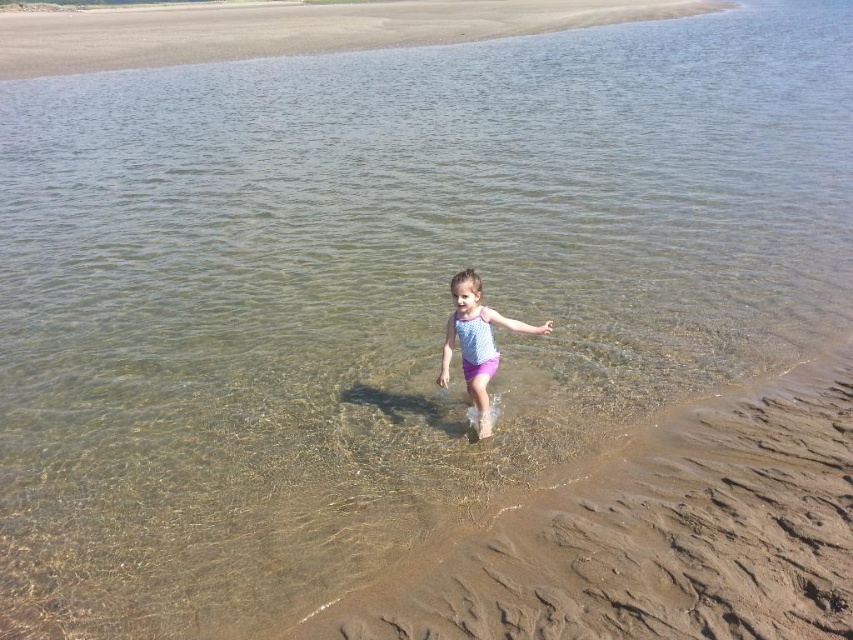
Question: Estimate the real-world distances between objects in this image. Which object is closer to the smooth brown sand at center?

Choices:
 (A) smooth sand at upper center
 (B) patterned fabric child at center

Answer: (B)

Question: Which object appears closest to the camera in this image?

Choices:
 (A) patterned fabric child at center
 (B) smooth brown sand at center

Answer: (B)

Question: Does smooth sand at upper center appear over patterned fabric child at center?

Choices:
 (A) no
 (B) yes

Answer: (B)

Question: Is smooth brown sand at center below patterned fabric child at center?

Choices:
 (A) yes
 (B) no

Answer: (A)

Question: Based on their relative distances, which object is farther from the patterned fabric child at center?

Choices:
 (A) smooth sand at upper center
 (B) smooth brown sand at center

Answer: (A)

Question: Can you confirm if smooth sand at upper center is positioned above patterned fabric child at center?

Choices:
 (A) yes
 (B) no

Answer: (A)